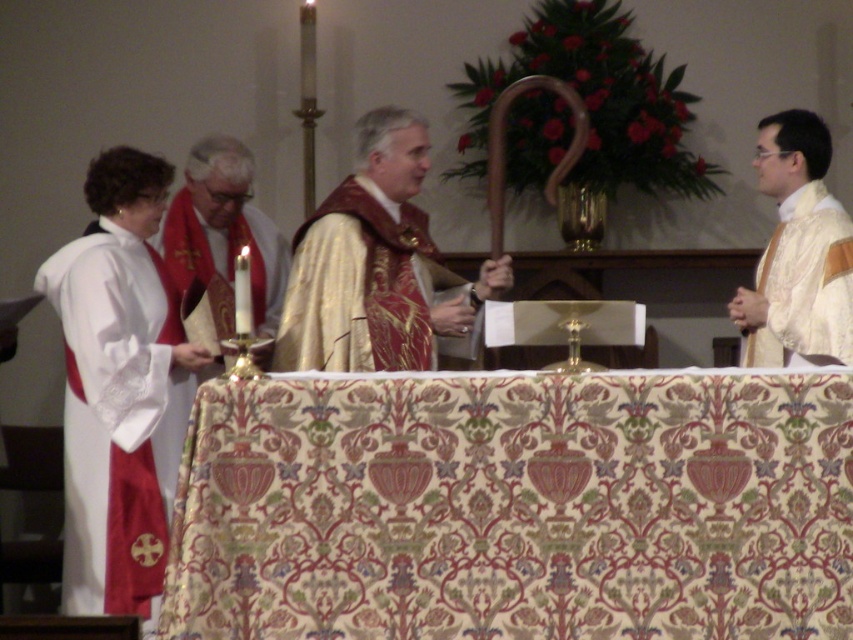
Can you confirm if gold embroidered robe at center is wider than white satin robe at right?

Yes.

Who is more distant from viewer, (x=321, y=356) or (x=816, y=227)?

The point (x=321, y=356) is behind.

Who is more distant from viewer, (303, 339) or (811, 346)?

The point (303, 339) is more distant.

Locate an element on the screen. This screenshot has width=853, height=640. gold embroidered robe at center is located at coordinates 360,288.

Between white satin robe at left and white satin robe at right, which one has less height?

With less height is white satin robe at right.

Does white satin robe at left appear over white satin robe at right?

No, white satin robe at left is not above white satin robe at right.

Is point (149, 372) closer to viewer compared to point (779, 280)?

Yes, it is in front of point (779, 280).

This screenshot has height=640, width=853. What are the coordinates of `white satin robe at left` in the screenshot? It's located at (115, 417).

Is point (100, 237) positioned after point (358, 227)?

No, it is in front of (358, 227).

Which is in front, point (108, 230) or point (347, 346)?

Positioned in front is point (347, 346).

At what (x,y) coordinates should I click in order to perform the action: click on white satin robe at left. Please return your answer as a coordinate pair (x, y). Looking at the image, I should click on (115, 417).

What are the coordinates of `white satin robe at left` in the screenshot? It's located at tap(115, 417).